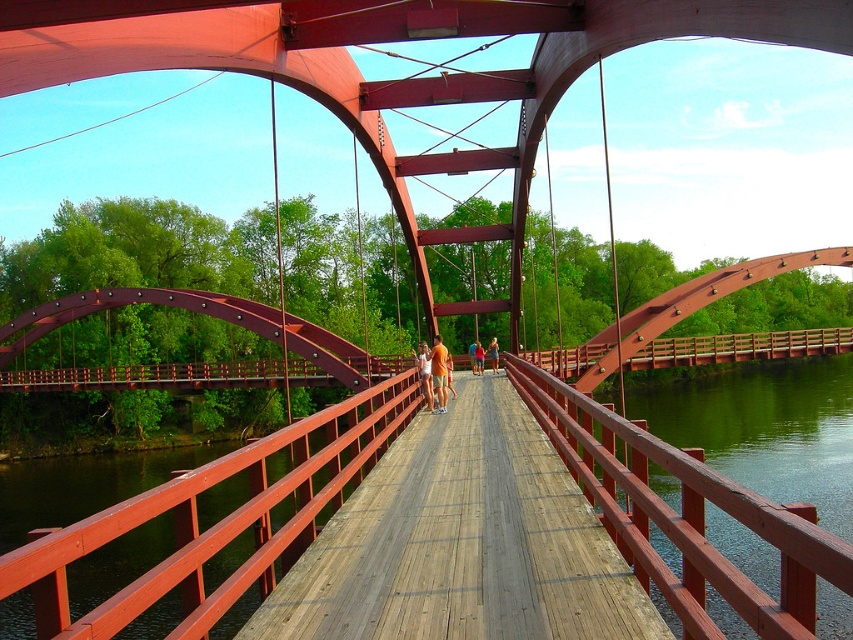
Is point (457, 508) positioned behind point (479, 365)?

That is False.

Is wooden bridge at center bigger than orange shirt at center?

No, wooden bridge at center is not bigger than orange shirt at center.

Is point (410, 522) closer to viewer compared to point (474, 353)?

Yes, it is.

The width and height of the screenshot is (853, 640). In order to click on wooden bridge at center in this screenshot , I will do `click(462, 544)`.

Who is more distant from viewer, (280,620) or (437,364)?

The point (437,364) is behind.

Can you confirm if wooden bridge at center is positioned below orange cotton shirt at center?

Indeed, wooden bridge at center is positioned under orange cotton shirt at center.

Does point (578, 557) come farther from viewer compared to point (440, 387)?

No.

Identify the location of wooden bridge at center. The image size is (853, 640). (462, 544).

Does wooden bridge at center appear under matte orange shorts at center?

Yes.

Is wooden bridge at center wider than matte orange shorts at center?

Correct, the width of wooden bridge at center exceeds that of matte orange shorts at center.

Is point (532, 538) closer to camera compared to point (490, 362)?

Yes.

Locate an element on the screen. The image size is (853, 640). wooden bridge at center is located at coordinates (462, 544).